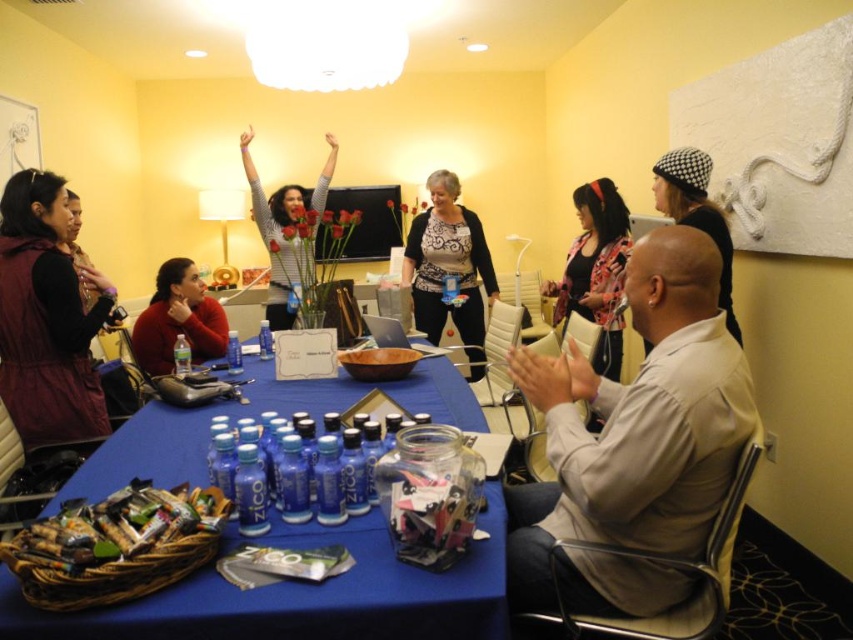
Which of these two, beige fabric shirt at lower right or floral-patterned jacket at center, stands shorter?

beige fabric shirt at lower right

Between point (569, 397) and point (616, 236), which one is positioned in front?

Point (569, 397) is more forward.

Identify the location of beige fabric shirt at lower right. This screenshot has width=853, height=640. (633, 444).

Can you confirm if maroon textured vest at left is smaller than black lace cardigan at center?

Correct, maroon textured vest at left occupies less space than black lace cardigan at center.

You are a GUI agent. You are given a task and a screenshot of the screen. Output one action in this format:
    pyautogui.click(x=<x>, y=<y>)
    Task: Click on the maroon textured vest at left
    The image size is (853, 640).
    Given the screenshot: What is the action you would take?
    pyautogui.click(x=45, y=317)

Looking at this image, does beige fabric shirt at lower right have a greater height compared to striped sweater at center?

No.

Looking at this image, who is higher up, beige fabric shirt at lower right or striped sweater at center?

Positioned higher is striped sweater at center.

Where is `beige fabric shirt at lower right`? This screenshot has width=853, height=640. beige fabric shirt at lower right is located at coordinates (633, 444).